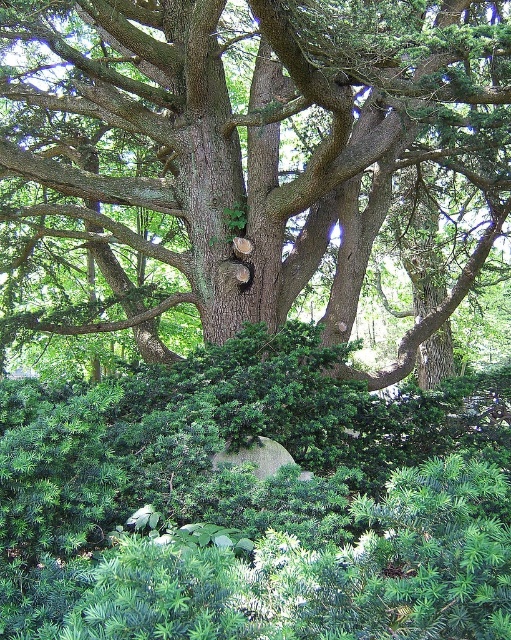
Question: Does green needle-like bush at center have a greater width compared to smooth brown tree trunk at center?

Choices:
 (A) yes
 (B) no

Answer: (B)

Question: Can you confirm if green needle-like bush at center is bigger than smooth brown tree trunk at center?

Choices:
 (A) yes
 (B) no

Answer: (B)

Question: Can you confirm if green needle-like bush at center is thinner than smooth brown tree trunk at center?

Choices:
 (A) no
 (B) yes

Answer: (B)